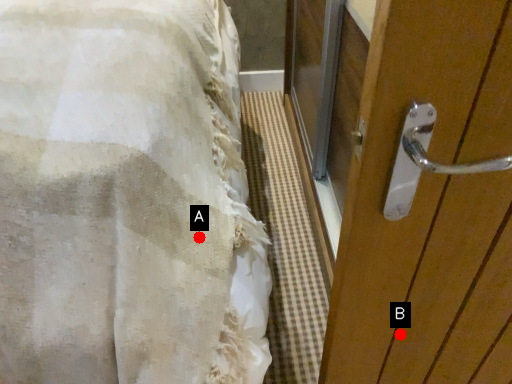
Question: Two points are circled on the image, labeled by A and B beside each circle. Which point appears closest to the camera in this image?

Choices:
 (A) A is closer
 (B) B is closer

Answer: (A)